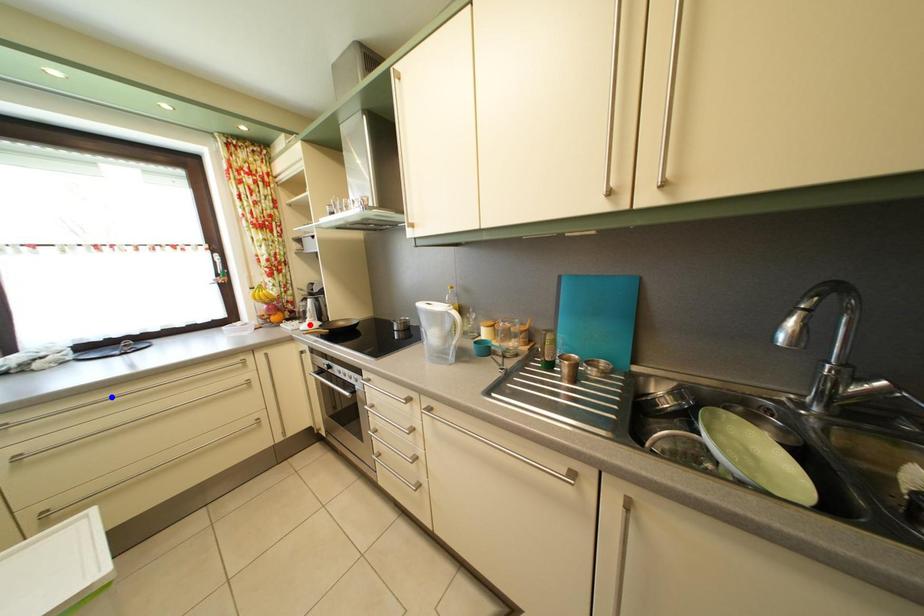
Question: In the image, two points are highlighted. Which point is nearer to the camera? Reply with the corresponding letter.

Choices:
 (A) blue point
 (B) red point

Answer: (A)